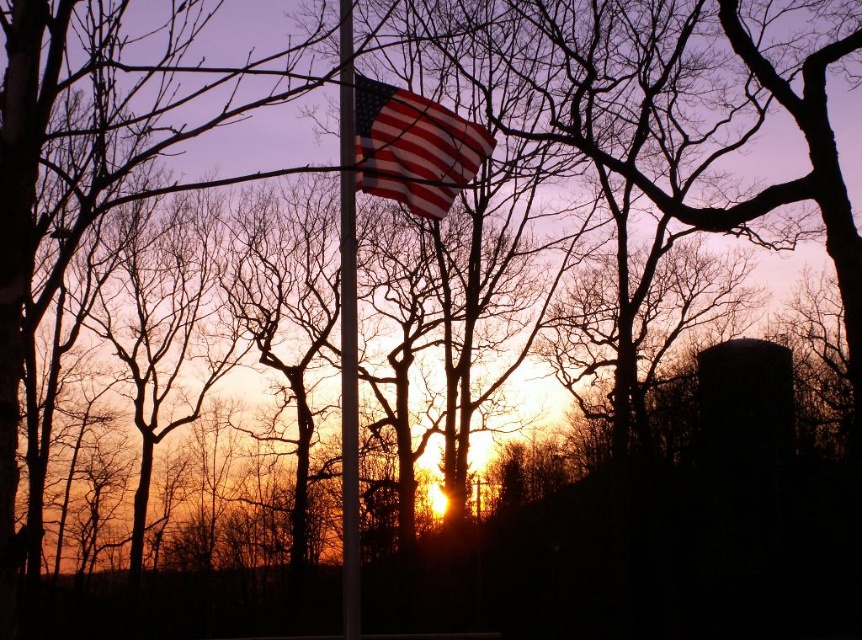
You are standing 10 meters away from a tree. You want to place a bench between yourself and the american flag at center so that the bench is exactly halfway between you and the flag. Is this possible?

The distance between you and the american flag at center is 12.71 meters. Since you are currently 10 meters away from the tree, placing a bench halfway would require the total distance to be at least 20 meters. However, the actual distance is only 12.71 meters, so it is not possible to place the bench exactly halfway between you and the flag under these conditions.

You are a photographer trying to capture the sunset scene. You notice the american flag at center and the metallic pole at center. Which object is closer to your camera lens?

The american flag at center is closer to the camera lens because it is positioned further to the viewer than the metallic pole at center.